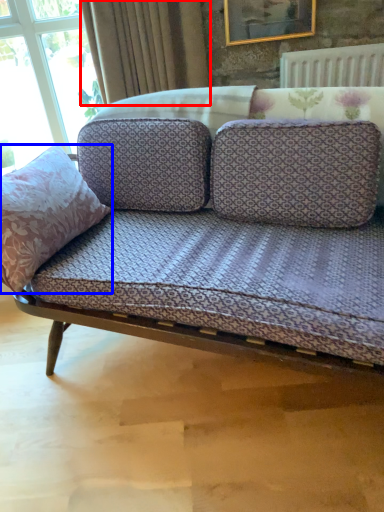
Question: Among these objects, which one is farthest to the camera, curtain (highlighted by a red box) or throw pillow (highlighted by a blue box)?

Choices:
 (A) curtain
 (B) throw pillow

Answer: (A)